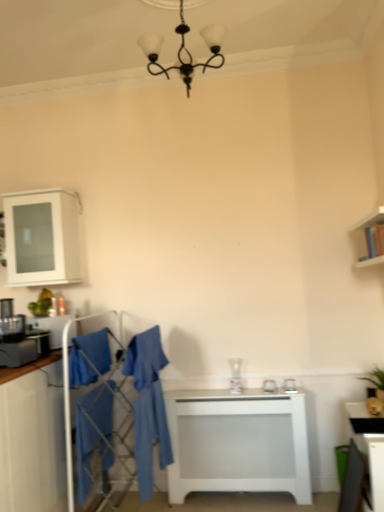
Question: Is the depth of blue fabric swivel chair at center less than that of white glossy table at lower right, which ranks as the 2th table in left-to-right order?

Choices:
 (A) yes
 (B) no

Answer: (B)

Question: Would you say white glossy table at lower right, which ranks as the 2th table in left-to-right order, is part of blue fabric swivel chair at center's contents?

Choices:
 (A) no
 (B) yes

Answer: (A)

Question: Does blue fabric swivel chair at center have a smaller size compared to white glossy table at lower right, which ranks as the 2th table in left-to-right order?

Choices:
 (A) yes
 (B) no

Answer: (B)

Question: Does blue fabric swivel chair at center appear on the right side of white glossy table at lower right, the 2th table when ordered from back to front?

Choices:
 (A) yes
 (B) no

Answer: (B)

Question: From a real-world perspective, is blue fabric swivel chair at center located beneath white glossy table at lower right, which ranks as the 2th table in left-to-right order?

Choices:
 (A) no
 (B) yes

Answer: (A)

Question: Is white glossy table at lower right, which ranks as the 2th table in left-to-right order, taller or shorter than matte black toaster at left, which appears as the 1th appliance when viewed from the top?

Choices:
 (A) tall
 (B) short

Answer: (A)

Question: Is white glossy table at lower right, which is the 1th table in right-to-left order, bigger or smaller than matte black toaster at left, positioned as the second appliance in bottom-to-top order?

Choices:
 (A) small
 (B) big

Answer: (B)

Question: Looking at their shapes, would you say white glossy table at lower right, the first table in the front-to-back sequence, is wider or thinner than matte black toaster at left, positioned as the second appliance in bottom-to-top order?

Choices:
 (A) wide
 (B) thin

Answer: (A)

Question: Relative to matte black toaster at left, which appears as the 1th appliance when viewed from the top, is white glossy table at lower right, the 2th table when ordered from back to front, in front or behind?

Choices:
 (A) front
 (B) behind

Answer: (A)

Question: From a real-world perspective, relative to white glossy vase at center, the second appliance viewed from the left, is matte white cabinet at left, the 2th cabinetry positioned from the top, vertically above or below?

Choices:
 (A) above
 (B) below

Answer: (B)

Question: Considering the positions of matte white cabinet at left, the 2th cabinetry positioned from the top, and white glossy vase at center, the first appliance positioned from the bottom, in the image, is matte white cabinet at left, the 2th cabinetry positioned from the top, taller or shorter than white glossy vase at center, the first appliance positioned from the bottom,?

Choices:
 (A) short
 (B) tall

Answer: (B)

Question: Based on their sizes in the image, would you say matte white cabinet at left, the 2th cabinetry positioned from the top, is bigger or smaller than white glossy vase at center, which is counted as the first appliance, starting from the back?

Choices:
 (A) small
 (B) big

Answer: (B)

Question: Relative to white glossy vase at center, the second appliance viewed from the left, is matte white cabinet at left, the 2th cabinetry positioned from the top, in front or behind?

Choices:
 (A) front
 (B) behind

Answer: (A)

Question: Is white matte table at center, marked as the 2th table in a front-to-back arrangement, inside the boundaries of blue fabric robe at center, positioned as the third robe in left-to-right order, or outside?

Choices:
 (A) outside
 (B) inside

Answer: (A)

Question: Considering their positions, is white matte table at center, which is counted as the first table, starting from the back, located in front of or behind blue fabric robe at center, positioned as the third robe in left-to-right order?

Choices:
 (A) behind
 (B) front

Answer: (A)